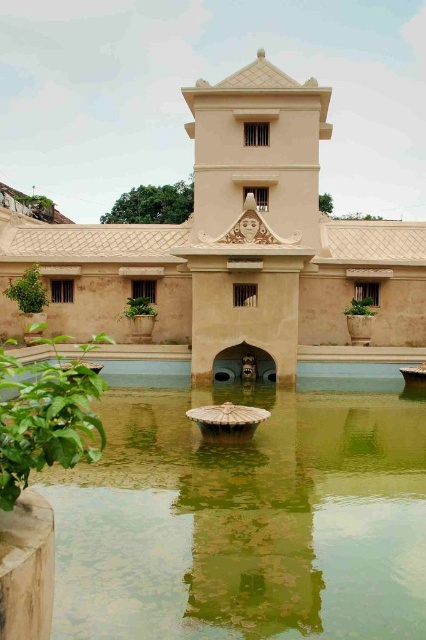
Question: Is green stone water at center bigger than beige stone palace at center?

Choices:
 (A) no
 (B) yes

Answer: (A)

Question: Can you confirm if green stone water at center is bigger than beige stone palace at center?

Choices:
 (A) no
 (B) yes

Answer: (A)

Question: Which point is farther from the camera taking this photo?

Choices:
 (A) (218, 230)
 (B) (250, 490)

Answer: (A)

Question: Which point is farther from the camera taking this photo?

Choices:
 (A) (134, 436)
 (B) (319, 260)

Answer: (B)

Question: Where is green stone water at center located in relation to beige stone palace at center in the image?

Choices:
 (A) left
 (B) right

Answer: (B)